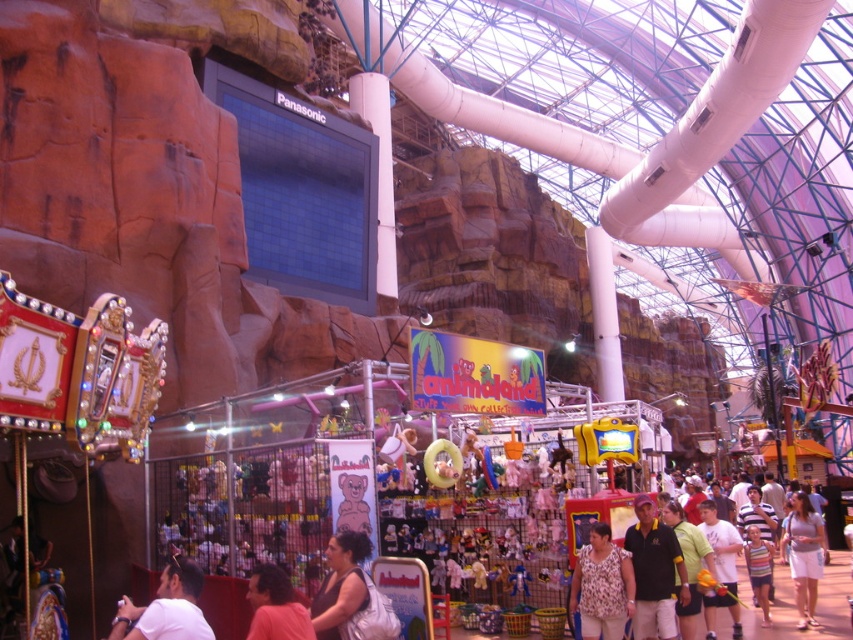
Question: Is light purple fabric dress at lower right behind light brown hair at lower center?

Choices:
 (A) no
 (B) yes

Answer: (B)

Question: Which point is closer to the camera?

Choices:
 (A) yellow-green shirt at center
 (B) white matte shirt at lower left

Answer: (B)

Question: Which point is farther from the camera taking this photo?

Choices:
 (A) (291, 605)
 (B) (328, 636)

Answer: (B)

Question: Which object is farther from the camera taking this photo?

Choices:
 (A) matte white backpack at center
 (B) printed fabric blouse at center
 (C) light brown hair at lower center

Answer: (B)

Question: Does white matte shirt at lower left appear on the left side of light brown hair at lower center?

Choices:
 (A) no
 (B) yes

Answer: (B)

Question: Is light purple fabric dress at lower right bigger than light brown hair at lower center?

Choices:
 (A) yes
 (B) no

Answer: (A)